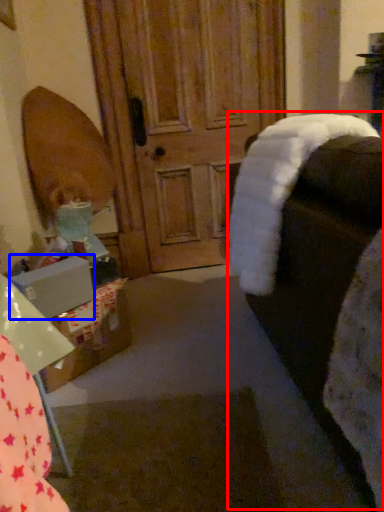
Question: Which object appears closest to the camera in this image, rocking chair (highlighted by a red box) or box (highlighted by a blue box)?

Choices:
 (A) rocking chair
 (B) box

Answer: (A)